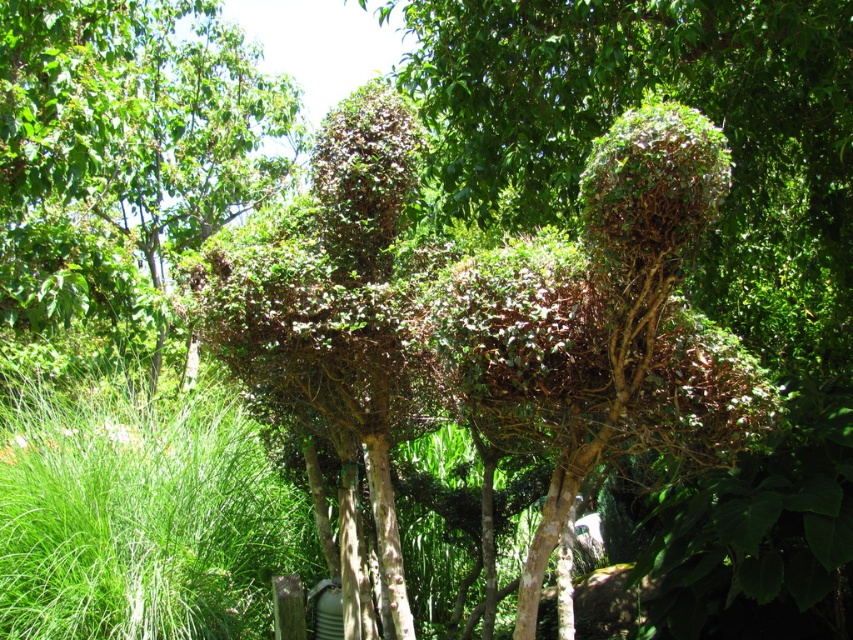
Question: Which point is closer to the camera?

Choices:
 (A) (158, 524)
 (B) (291, 97)

Answer: (A)

Question: Which of the following is the closest to the observer?

Choices:
 (A) green leafy grass at lower left
 (B) green leafy bush at center

Answer: (A)

Question: Which point appears farthest from the camera in this image?

Choices:
 (A) (22, 468)
 (B) (175, 221)

Answer: (B)

Question: Is green leafy bush at center thinner than green leafy grass at lower left?

Choices:
 (A) no
 (B) yes

Answer: (B)

Question: Does green leafy bush at center appear on the left side of green leafy grass at lower left?

Choices:
 (A) no
 (B) yes

Answer: (B)

Question: From the image, what is the correct spatial relationship of green leafy bush at center in relation to green leafy grass at lower left?

Choices:
 (A) below
 (B) above

Answer: (B)